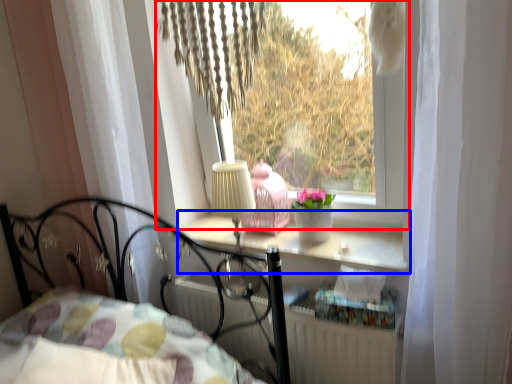
Question: Which of the following is the farthest to the observer, window (highlighted by a red box) or window sill (highlighted by a blue box)?

Choices:
 (A) window
 (B) window sill

Answer: (B)